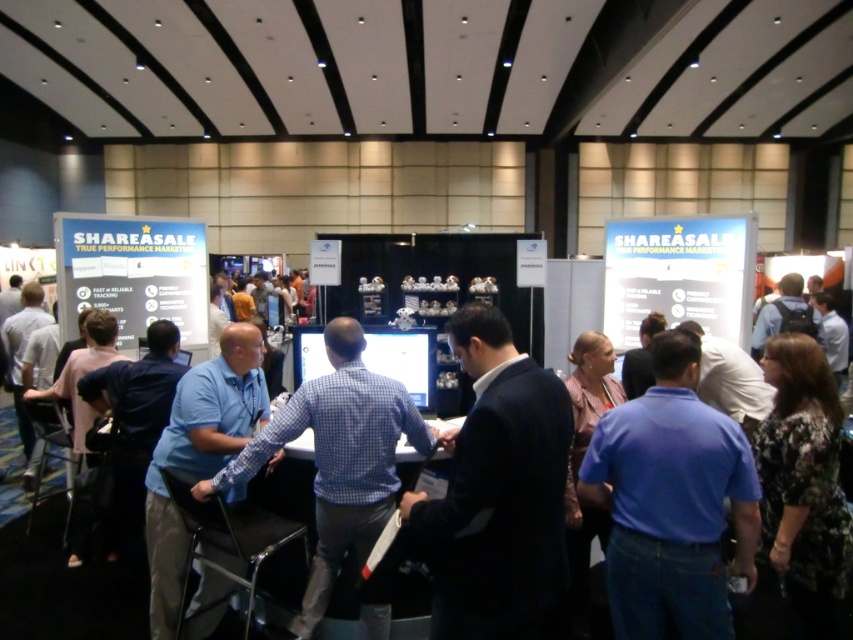
Question: Among these objects, which one is nearest to the camera?

Choices:
 (A) blue denim shirt at center
 (B) dark blue suit at center
 (C) blue shirt at center

Answer: (B)

Question: Can you confirm if dark blue suit at center is smaller than blue denim shirt at center?

Choices:
 (A) yes
 (B) no

Answer: (B)

Question: Which of the following is the farthest from the observer?

Choices:
 (A) (439, 636)
 (B) (747, 589)
 (C) (27, 563)

Answer: (C)

Question: Does dark blue suit at center appear under blue shirt at center?

Choices:
 (A) yes
 (B) no

Answer: (B)

Question: Which object is the closest to the blue denim shirt at center?

Choices:
 (A) dark blue suit at center
 (B) blue shirt at center

Answer: (A)

Question: Does dark blue suit at center appear on the left side of blue denim shirt at center?

Choices:
 (A) no
 (B) yes

Answer: (B)